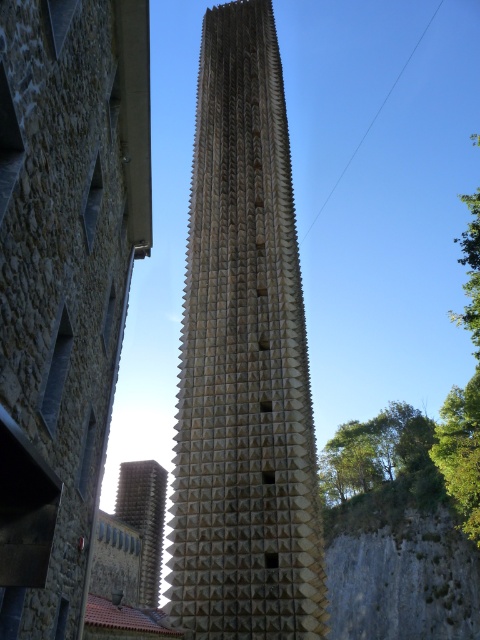
Between point (276, 605) and point (153, 499), which one is positioned in front?

Positioned in front is point (276, 605).

Between sandy beige textured tower at center and golden textured spire at center, which one appears on the left side from the viewer's perspective?

golden textured spire at center is more to the left.

The height and width of the screenshot is (640, 480). What do you see at coordinates (243, 360) in the screenshot?
I see `sandy beige textured tower at center` at bounding box center [243, 360].

I want to click on sandy beige textured tower at center, so 243,360.